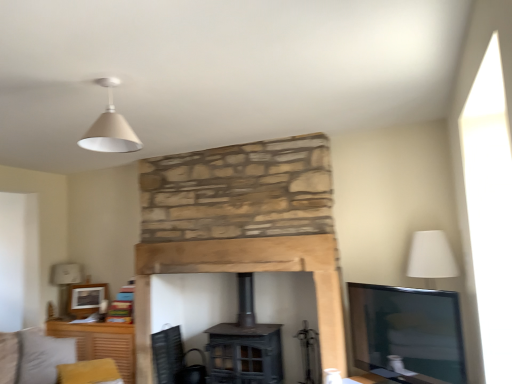
This screenshot has height=384, width=512. Find the location of `free space above rustic wood fireplace at center (from a real-world perspective)`. free space above rustic wood fireplace at center (from a real-world perspective) is located at coordinates (220, 241).